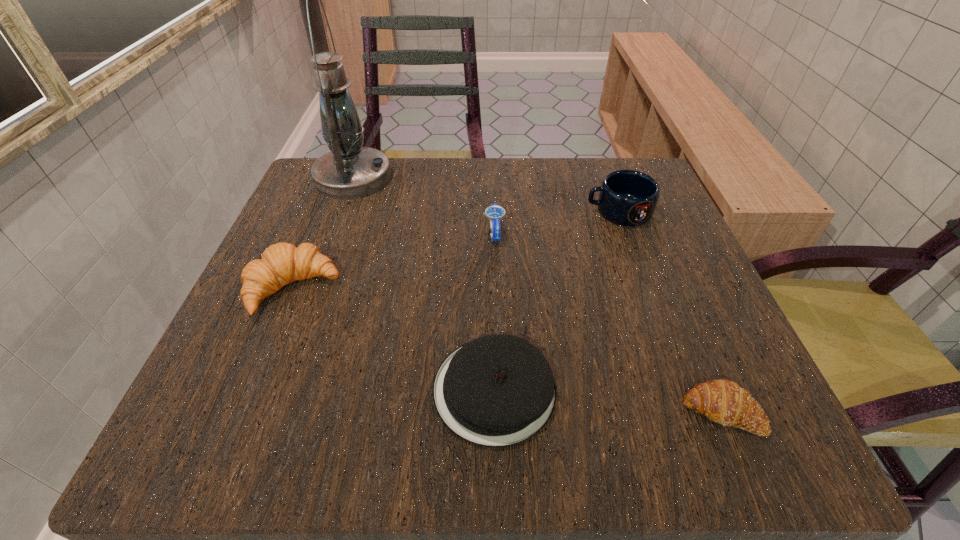
At what (x,y) coordinates should I click in order to perform the action: click on vacant region located with the handle on the side of the mug. Please return your answer as a coordinate pair (x, y). Looking at the image, I should click on (482, 212).

Where is `vacant space positioned with the handle on the side of the mug`? The height and width of the screenshot is (540, 960). vacant space positioned with the handle on the side of the mug is located at coordinates (507, 212).

I want to click on free space located 0.130m on the right of the farther crescent roll, so click(x=417, y=289).

Identify the location of blank space located 0.250m on the right of the watch. This screenshot has height=540, width=960. (636, 233).

Find the location of a particular element. vacant space located on the left of the pancake is located at coordinates (317, 390).

You are a GUI agent. You are given a task and a screenshot of the screen. Output one action in this format:
    pyautogui.click(x=<x>, y=<y>)
    Task: Click on the free space located 0.080m on the back of the shortest object
    The image size is (960, 540).
    Given the screenshot: What is the action you would take?
    pyautogui.click(x=691, y=340)

Where is `oil lamp at the far edge`? oil lamp at the far edge is located at coordinates (350, 171).

The width and height of the screenshot is (960, 540). What are the coordinates of `mug that is at the far edge` in the screenshot? It's located at (627, 197).

At what (x,y) coordinates should I click in order to perform the action: click on watch that is at the far edge. Please return your answer as a coordinate pair (x, y). This screenshot has width=960, height=540. Looking at the image, I should click on (x=495, y=213).

This screenshot has width=960, height=540. I want to click on pancake located in the near edge section of the desktop, so click(495, 391).